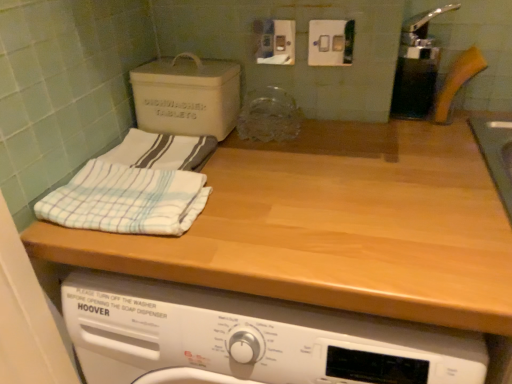
Question: Can you confirm if white striped cloth at upper left, the second bath towel when ordered from front to back, is positioned to the right of white striped cloth at left, the second bath towel from the back?

Choices:
 (A) no
 (B) yes

Answer: (B)

Question: Does white striped cloth at upper left, which is the 1th bath towel in back-to-front order, have a smaller size compared to white striped cloth at left, the second bath towel from the back?

Choices:
 (A) yes
 (B) no

Answer: (A)

Question: Is white striped cloth at upper left, the second bath towel when ordered from front to back, taller than white striped cloth at left, which is the first bath towel from front to back?

Choices:
 (A) yes
 (B) no

Answer: (B)

Question: Is white striped cloth at upper left, the second bath towel when ordered from front to back, facing away from white striped cloth at left, the second bath towel from the back?

Choices:
 (A) no
 (B) yes

Answer: (A)

Question: Does white striped cloth at upper left, which is the 1th bath towel in back-to-front order, turn towards white striped cloth at left, which is the first bath towel from front to back?

Choices:
 (A) yes
 (B) no

Answer: (A)

Question: Would you say white striped cloth at upper left, which is the 1th bath towel in back-to-front order, is outside white striped cloth at left, the second bath towel from the back?

Choices:
 (A) yes
 (B) no

Answer: (A)

Question: Does white striped cloth at upper left, which is the 1th bath towel in back-to-front order, turn towards matte gray cardboard box at upper left?

Choices:
 (A) no
 (B) yes

Answer: (A)

Question: Is white striped cloth at upper left, the second bath towel when ordered from front to back, taller than matte gray cardboard box at upper left?

Choices:
 (A) yes
 (B) no

Answer: (B)

Question: Is white striped cloth at upper left, the second bath towel when ordered from front to back, positioned beyond the bounds of matte gray cardboard box at upper left?

Choices:
 (A) yes
 (B) no

Answer: (A)

Question: From a real-world perspective, is white striped cloth at upper left, which is the 1th bath towel in back-to-front order, positioned over matte gray cardboard box at upper left based on gravity?

Choices:
 (A) no
 (B) yes

Answer: (A)

Question: From a real-world perspective, is white striped cloth at upper left, the second bath towel when ordered from front to back, physically below matte gray cardboard box at upper left?

Choices:
 (A) yes
 (B) no

Answer: (A)

Question: Is white striped cloth at upper left, the second bath towel when ordered from front to back, looking in the opposite direction of matte gray cardboard box at upper left?

Choices:
 (A) no
 (B) yes

Answer: (B)

Question: Is wooden at upper center at the left side of white striped cloth at upper left, which is the 1th bath towel in back-to-front order?

Choices:
 (A) yes
 (B) no

Answer: (B)